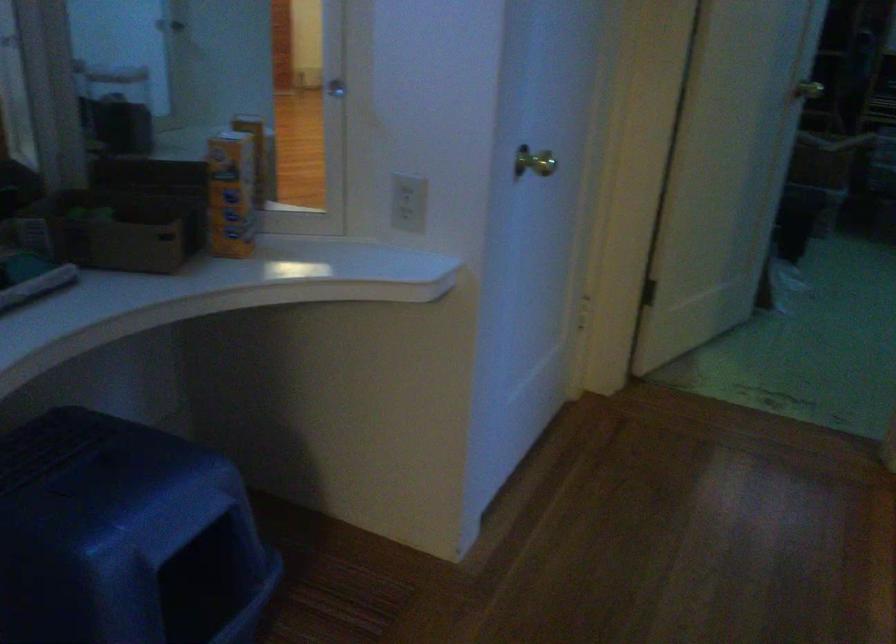
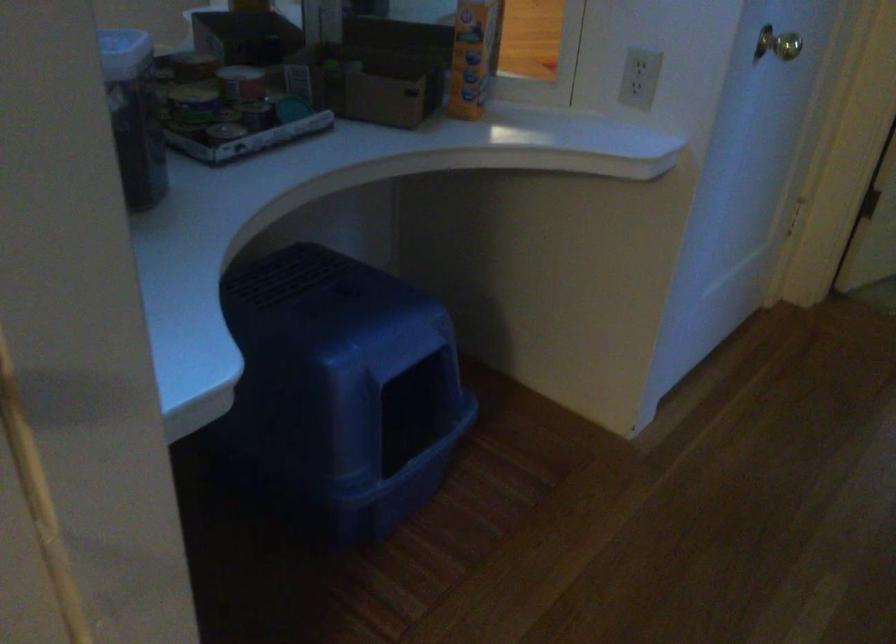
Locate, in the second image, the point that corresponds to (119,232) in the first image.

(369, 82)